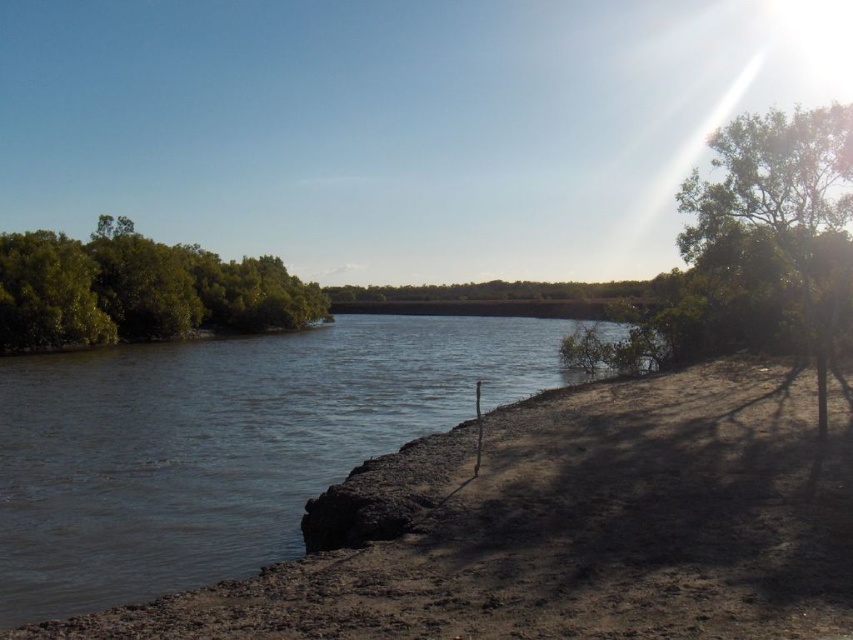
Question: Which object is positioned closest to the green leafy tree at right?

Choices:
 (A) green leafy trees at left
 (B) brown sedimentary river at center

Answer: (B)

Question: Which point is closer to the camera?

Choices:
 (A) brown sedimentary river at center
 (B) green leafy trees at left
 (C) green leafy tree at right

Answer: (A)

Question: Is green leafy trees at left thinner than green leafy tree at right?

Choices:
 (A) yes
 (B) no

Answer: (A)

Question: Does brown sedimentary river at center have a lesser width compared to green leafy tree at right?

Choices:
 (A) yes
 (B) no

Answer: (A)

Question: Does brown sedimentary river at center have a lesser width compared to green leafy trees at left?

Choices:
 (A) no
 (B) yes

Answer: (A)

Question: Estimate the real-world distances between objects in this image. Which object is farther from the brown sedimentary river at center?

Choices:
 (A) green leafy trees at left
 (B) green leafy tree at right

Answer: (B)